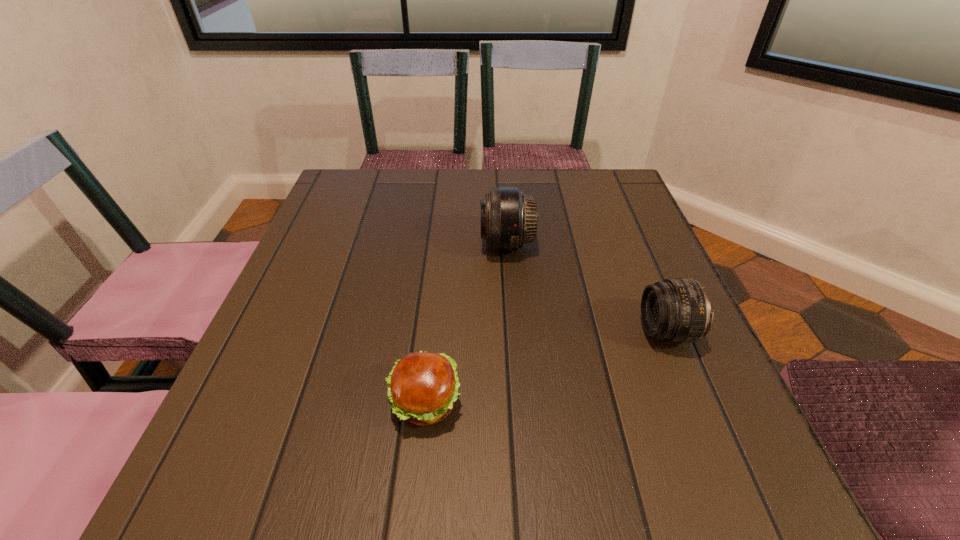
Image resolution: width=960 pixels, height=540 pixels. Identify the location of vacant space that is in between the nearer telephoto lens and the taller telephoto lens. (587, 288).

Locate which object ranks in proximity to the right telephoto lens. Please provide its 2D coordinates. Your answer should be formatted as a tuple, i.e. [(x, y)], where the tuple contains the x and y coordinates of a point satisfying the conditions above.

[(508, 217)]

You are a GUI agent. You are given a task and a screenshot of the screen. Output one action in this format:
    pyautogui.click(x=<x>, y=<y>)
    Task: Click on the object identified as the closest to the shorter telephoto lens
    The image size is (960, 540).
    Given the screenshot: What is the action you would take?
    pyautogui.click(x=508, y=217)

Find the location of a particular element. The height and width of the screenshot is (540, 960). free space that satisfies the following two spatial constraints: 1. at the front element of the shorter telephoto lens; 2. on the front side of the leftmost object is located at coordinates (696, 403).